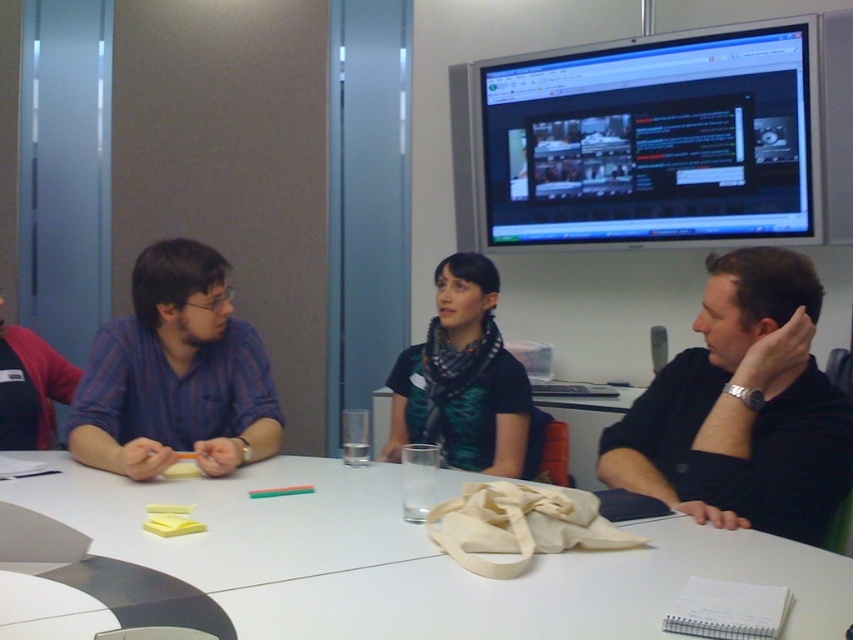
From the picture: You are a delivery robot carrying a box that is 1.2 meters long. You need to place it on the white matte table at center. Can you fit the box on the table without it overhanging the edges?

The distance between the white matte table at center and the viewer is 1.08 meters, but this measurement does not provide information about the table dimensions. Therefore, it is unclear if the box will fit without overhanging the edges.

Based on the photo, you are attending a meeting and need to present a slide. You are sitting at the blue striped shirt at left. The projector is connected to the black glossy monitor at upper right. To your left, there is an empty chair. Can you reach the monitor to adjust the settings without leaving your seat?

The black glossy monitor at upper right is positioned on the right side of blue striped shirt at left, so you can reach it without leaving your seat.

You are organizing a team photo and need to arrange the participants from smallest to largest based on their clothing sizes. Given the blue striped shirt at left and the black scarf at center, which should come first?

The blue striped shirt at left is smaller than the black scarf at center, so it should come first in the arrangement from smallest to largest clothing sizes.